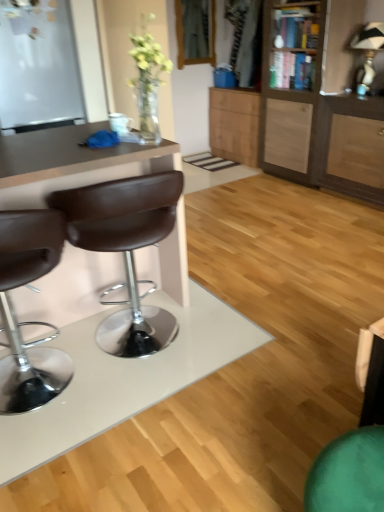
Question: Can you confirm if brown leather desk at left is shorter than brown leather stool at left, the 1th chair positioned from the left?

Choices:
 (A) no
 (B) yes

Answer: (A)

Question: From the image's perspective, is brown leather desk at left above brown leather stool at left, the 1th chair positioned from the left?

Choices:
 (A) yes
 (B) no

Answer: (A)

Question: Is brown leather desk at left at the left side of brown leather stool at left, the 1th chair positioned from the left?

Choices:
 (A) no
 (B) yes

Answer: (A)

Question: Is brown leather desk at left in contact with brown leather stool at left, the 1th chair positioned from the left?

Choices:
 (A) yes
 (B) no

Answer: (B)

Question: Is brown leather desk at left facing away from brown leather stool at left, placed as the 2th chair when sorted from right to left?

Choices:
 (A) no
 (B) yes

Answer: (A)

Question: Relative to brown leather stool at left, placed as the 2th chair when sorted from right to left, is brown leather stool at left, arranged as the 1th chair when viewed from the right, in front or behind?

Choices:
 (A) front
 (B) behind

Answer: (B)

Question: Is brown leather stool at left, which appears as the 2th chair when viewed from the left, wider or thinner than brown leather stool at left, the 1th chair positioned from the left?

Choices:
 (A) wide
 (B) thin

Answer: (B)

Question: Visually, is brown leather stool at left, which appears as the 2th chair when viewed from the left, positioned to the left or to the right of brown leather stool at left, placed as the 2th chair when sorted from right to left?

Choices:
 (A) left
 (B) right

Answer: (B)

Question: From the image's perspective, is brown leather stool at left, arranged as the 1th chair when viewed from the right, above or below brown leather stool at left, the 1th chair positioned from the left?

Choices:
 (A) below
 (B) above

Answer: (B)

Question: Considering the positions of brown leather stool at left, placed as the 2th chair when sorted from right to left, and brown leather desk at left in the image, is brown leather stool at left, placed as the 2th chair when sorted from right to left, taller or shorter than brown leather desk at left?

Choices:
 (A) short
 (B) tall

Answer: (A)

Question: Do you think brown leather stool at left, placed as the 2th chair when sorted from right to left, is within brown leather desk at left, or outside of it?

Choices:
 (A) outside
 (B) inside

Answer: (B)

Question: From a real-world perspective, relative to brown leather desk at left, is brown leather stool at left, the 1th chair positioned from the left, vertically above or below?

Choices:
 (A) above
 (B) below

Answer: (B)

Question: Based on their sizes in the image, would you say brown leather stool at left, placed as the 2th chair when sorted from right to left, is bigger or smaller than brown leather desk at left?

Choices:
 (A) big
 (B) small

Answer: (B)

Question: In terms of height, does brown leather desk at left look taller or shorter compared to white matte glass door at upper left?

Choices:
 (A) short
 (B) tall

Answer: (A)

Question: Is point [x=178, y=287] closer or farther from the camera than point [x=44, y=98]?

Choices:
 (A) farther
 (B) closer

Answer: (B)